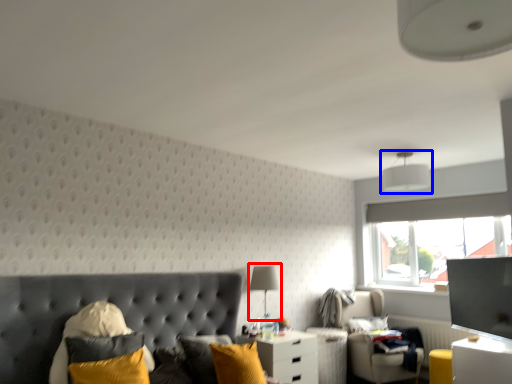
Question: Which object is closer to the camera taking this photo, table lamp (highlighted by a red box) or lamp (highlighted by a blue box)?

Choices:
 (A) table lamp
 (B) lamp

Answer: (A)